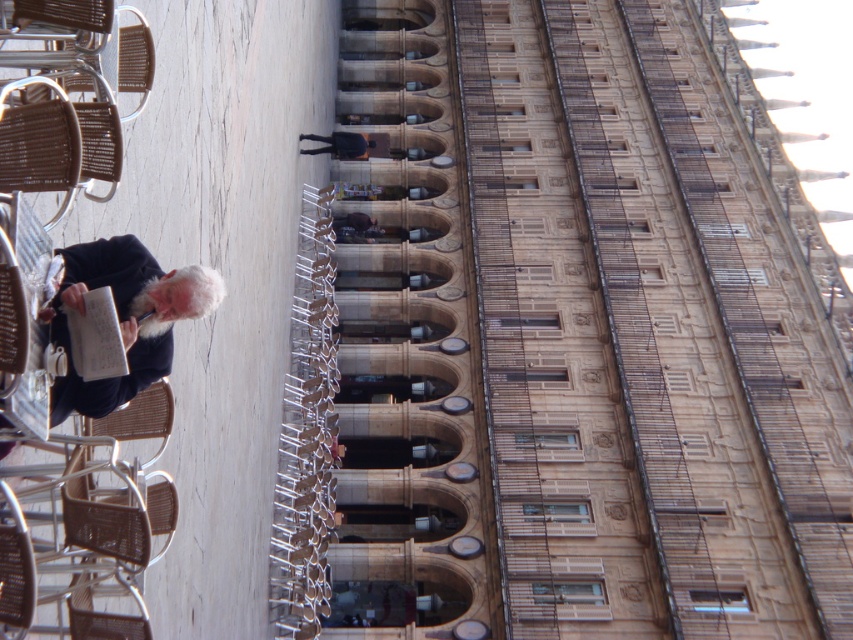
Question: Which point appears farthest from the camera in this image?

Choices:
 (A) (57, 412)
 (B) (67, 474)

Answer: (A)

Question: Is dark blue fabric at lower left wider than brown woven chair at lower left?

Choices:
 (A) no
 (B) yes

Answer: (B)

Question: Considering the real-world distances, which object is closest to the brown woven chair at lower left?

Choices:
 (A) dark blue fabric at lower left
 (B) woven brown chair at lower left

Answer: (A)

Question: Considering the relative positions of dark blue fabric at lower left and brown woven chair at lower left in the image provided, where is dark blue fabric at lower left located with respect to brown woven chair at lower left?

Choices:
 (A) above
 (B) below

Answer: (A)

Question: Which is nearer to the brown woven chair at lower left?

Choices:
 (A) dark blue fabric at lower left
 (B) woven brown chair at lower left

Answer: (A)

Question: Is the position of woven brown chair at lower left less distant than that of brown woven chair at lower left?

Choices:
 (A) no
 (B) yes

Answer: (B)